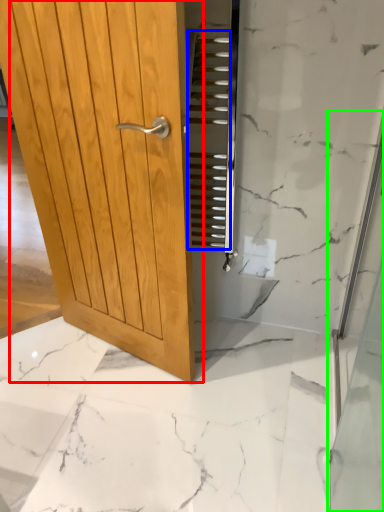
Question: Based on their relative distances, which object is farther from door (highlighted by a red box)? Choose from stair (highlighted by a blue box) and shower door (highlighted by a green box).

Choices:
 (A) stair
 (B) shower door

Answer: (B)